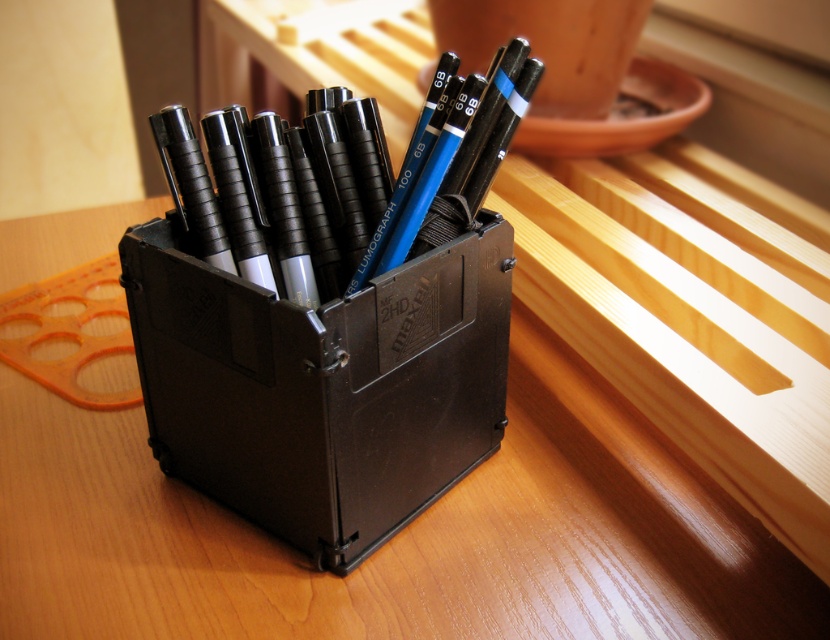
You are organizing your desk and want to place a small plant between the wooden table at center and the black plastic box at center. Since the plant needs enough space to grow, can you fit it vertically between them?

The wooden table at center is not as tall as the black plastic box at center, so the plant can be placed vertically between them as there is sufficient vertical space.

Based on the photo, you are organizing a desk and see the wooden table at center and the black plastic box at center. Which object is positioned lower?

The wooden table at center is below the black plastic box at center, so the wooden table at center is positioned lower.